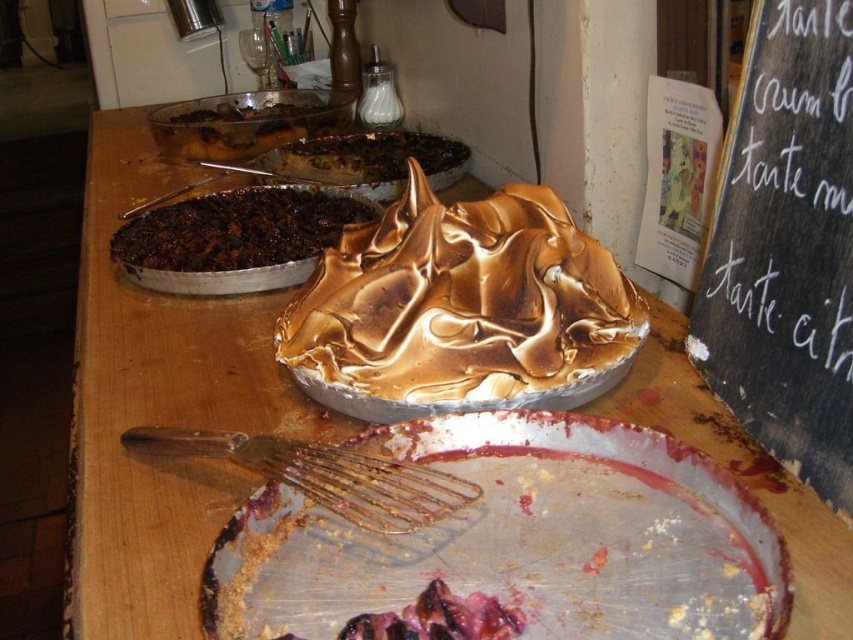
Between point (426, 577) and point (245, 221), which one is positioned behind?

Point (245, 221)

Can you confirm if metallic silver platter at center is positioned above dark brown crumbly pie at upper left?

No, metallic silver platter at center is not above dark brown crumbly pie at upper left.

Which is behind, point (474, 531) or point (183, 221)?

Positioned behind is point (183, 221).

Find the location of a particular element. This screenshot has height=640, width=853. metallic silver platter at center is located at coordinates (518, 540).

Which is more to the left, black chalkboard at upper right or gold metallic whisk at center?

Positioned to the left is gold metallic whisk at center.

Who is taller, black chalkboard at upper right or gold metallic whisk at center?

With more height is black chalkboard at upper right.

Between point (833, 244) and point (445, 506), which one is positioned in front?

Positioned in front is point (445, 506).

At what (x,y) coordinates should I click in order to perform the action: click on black chalkboard at upper right. Please return your answer as a coordinate pair (x, y). This screenshot has height=640, width=853. Looking at the image, I should click on (786, 248).

Does golden brown meringue at center have a smaller size compared to charred rubberized meat at center?

Actually, golden brown meringue at center might be larger than charred rubberized meat at center.

Is golden brown meringue at center positioned behind charred rubberized meat at center?

Yes, it is behind charred rubberized meat at center.

Identify the location of golden brown meringue at center. The image size is (853, 640). (462, 307).